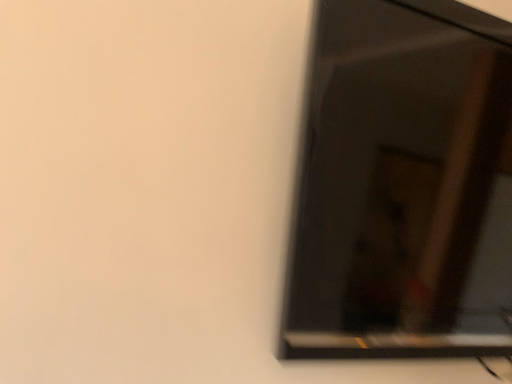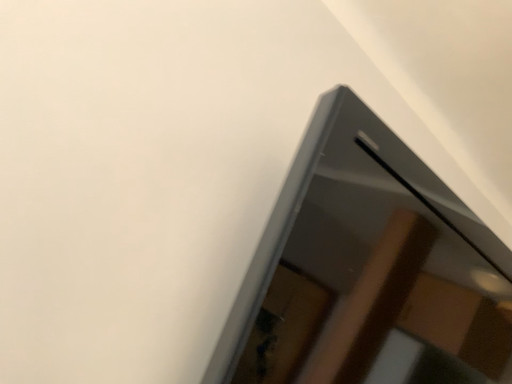
Question: Which way did the camera rotate in the video?

Choices:
 (A) rotated downward
 (B) rotated upward

Answer: (B)